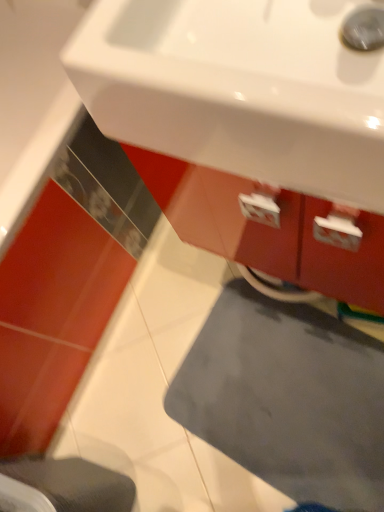
Identify the location of gray fabric step stool at lower left. The image size is (384, 512). (74, 484).

From the image's perspective, would you say white glossy sink at upper center is shown under gray matte bath mat at lower center?

No.

Is white glossy sink at upper center wider or thinner than gray matte bath mat at lower center?

Clearly, white glossy sink at upper center has less width compared to gray matte bath mat at lower center.

At what (x,y) coordinates should I click in order to perform the action: click on bath mat below the white glossy sink at upper center (from the image's perspective). Please return your answer as a coordinate pair (x, y). Looking at the image, I should click on (287, 398).

How many degrees apart are the facing directions of white glossy sink at upper center and gray matte bath mat at lower center?

white glossy sink at upper center and gray matte bath mat at lower center are facing 82.9 degrees away from each other.

From the image's perspective, would you say gray matte bath mat at lower center is shown under gray fabric step stool at lower left?

No, from the image's perspective, gray matte bath mat at lower center is not beneath gray fabric step stool at lower left.

Does gray matte bath mat at lower center contain gray fabric step stool at lower left?

No, gray fabric step stool at lower left is located outside of gray matte bath mat at lower center.

Which of these two, gray matte bath mat at lower center or gray fabric step stool at lower left, is smaller?

With smaller size is gray matte bath mat at lower center.

Is gray matte bath mat at lower center aimed at gray fabric step stool at lower left?

No, gray matte bath mat at lower center is not aimed at gray fabric step stool at lower left.

Can you confirm if white glossy sink at upper center is smaller than gray fabric step stool at lower left?

Yes, white glossy sink at upper center is smaller than gray fabric step stool at lower left.

What's the angular difference between white glossy sink at upper center and gray fabric step stool at lower left's facing directions?

white glossy sink at upper center and gray fabric step stool at lower left are facing 173 degrees away from each other.

Is white glossy sink at upper center oriented towards gray fabric step stool at lower left?

No, white glossy sink at upper center is not turned towards gray fabric step stool at lower left.

In terms of width, does white glossy sink at upper center look wider or thinner when compared to gray fabric step stool at lower left?

Clearly, white glossy sink at upper center has more width compared to gray fabric step stool at lower left.

Which of these two, gray fabric step stool at lower left or gray matte bath mat at lower center, is wider?

Wider between the two is gray matte bath mat at lower center.

Who is smaller, gray fabric step stool at lower left or gray matte bath mat at lower center?

gray matte bath mat at lower center is smaller.

From a real-world perspective, who is located lower, gray fabric step stool at lower left or gray matte bath mat at lower center?

In real-world perspective, gray matte bath mat at lower center is lower.

From the picture: Is gray fabric step stool at lower left positioned beyond the bounds of gray matte bath mat at lower center?

gray fabric step stool at lower left is positioned outside gray matte bath mat at lower center.

Does gray matte bath mat at lower center have a greater width compared to white glossy sink at upper center?

Correct, the width of gray matte bath mat at lower center exceeds that of white glossy sink at upper center.

Based on the photo, from a real-world perspective, who is located lower, gray matte bath mat at lower center or white glossy sink at upper center?

gray matte bath mat at lower center is physically lower.

Is white glossy sink at upper center at the back of gray matte bath mat at lower center?

No, gray matte bath mat at lower center is not facing away from white glossy sink at upper center.

Is gray matte bath mat at lower center taller or shorter than white glossy sink at upper center?

gray matte bath mat at lower center is shorter than white glossy sink at upper center.

Can you tell me how much gray fabric step stool at lower left and white glossy sink at upper center differ in facing direction?

173 degrees separate the facing orientations of gray fabric step stool at lower left and white glossy sink at upper center.

Considering their positions, is gray fabric step stool at lower left located in front of or behind white glossy sink at upper center?

Visually, gray fabric step stool at lower left is located behind white glossy sink at upper center.

Which object is wider, gray fabric step stool at lower left or white glossy sink at upper center?

Wider between the two is white glossy sink at upper center.

I want to click on sink on the left of the gray matte bath mat at lower center, so click(239, 90).

Locate an element on the screen. bath mat beneath the gray fabric step stool at lower left (from a real-world perspective) is located at coordinates (287, 398).

Which object lies nearer to the anchor point white glossy sink at upper center, gray fabric step stool at lower left or gray matte bath mat at lower center?

gray fabric step stool at lower left is closer to white glossy sink at upper center.

Considering their positions, is gray fabric step stool at lower left positioned further to gray matte bath mat at lower center than white glossy sink at upper center?

white glossy sink at upper center is positioned further to the anchor gray matte bath mat at lower center.

Based on their spatial positions, is white glossy sink at upper center or gray fabric step stool at lower left further from gray matte bath mat at lower center?

white glossy sink at upper center is further to gray matte bath mat at lower center.

When comparing their distances from gray fabric step stool at lower left, does gray matte bath mat at lower center or white glossy sink at upper center seem closer?

gray matte bath mat at lower center.

Which object lies further to the anchor point gray fabric step stool at lower left, white glossy sink at upper center or gray matte bath mat at lower center?

The object further to gray fabric step stool at lower left is white glossy sink at upper center.

Based on their spatial positions, is gray matte bath mat at lower center or gray fabric step stool at lower left closer to white glossy sink at upper center?

Based on the image, gray fabric step stool at lower left appears to be nearer to white glossy sink at upper center.

Where is `bath mat between white glossy sink at upper center and gray fabric step stool at lower left in the vertical direction`? The height and width of the screenshot is (512, 384). bath mat between white glossy sink at upper center and gray fabric step stool at lower left in the vertical direction is located at coordinates (287, 398).